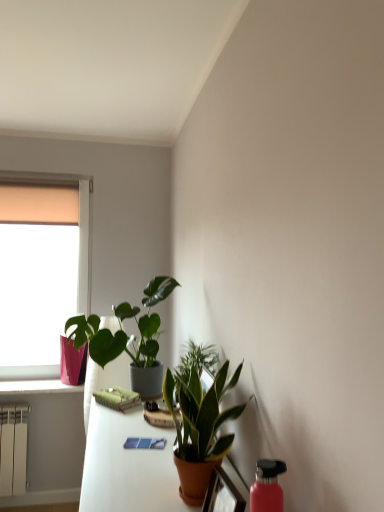
At what (x,y) coordinates should I click in order to perform the action: click on vacant area to the left of green glossy houseplant at center, the 1th houseplant positioned from the right. Please return your answer as a coordinate pair (x, y). Looking at the image, I should click on pos(135,485).